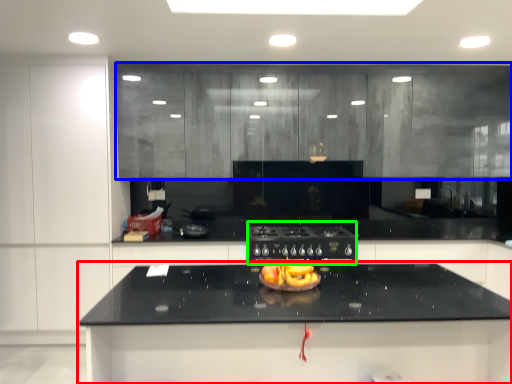
Question: Considering the real-world distances, which object is closest to countertop (highlighted by a red box)? cabinetry (highlighted by a blue box) or appliance (highlighted by a green box).

Choices:
 (A) cabinetry
 (B) appliance

Answer: (B)